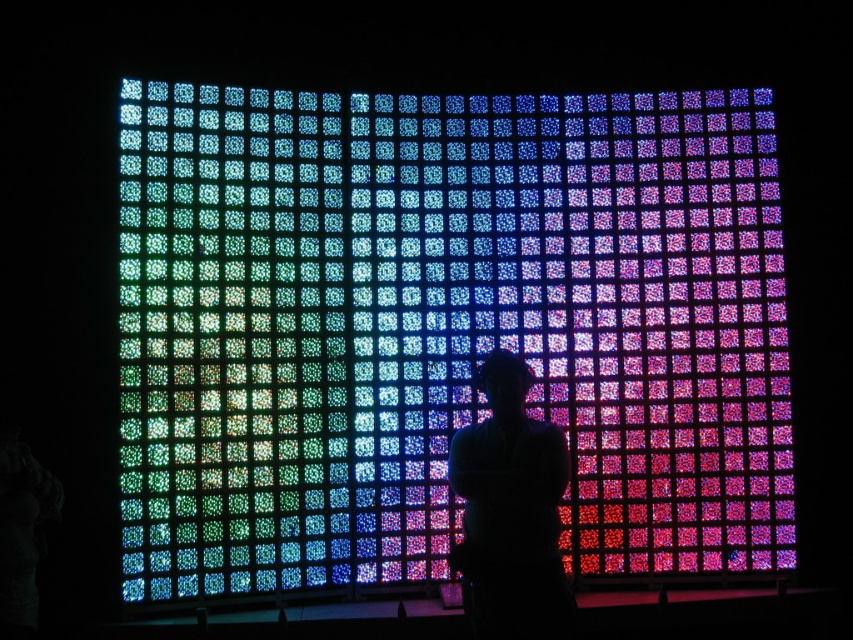
Is multicolored glass mosaic at center shorter than silhouette figure at center?

No.

Can you confirm if multicolored glass mosaic at center is thinner than silhouette figure at center?

No.

Is point (492, 337) positioned before point (512, 547)?

No, it is not.

Where is `multicolored glass mosaic at center`? multicolored glass mosaic at center is located at coordinates (444, 328).